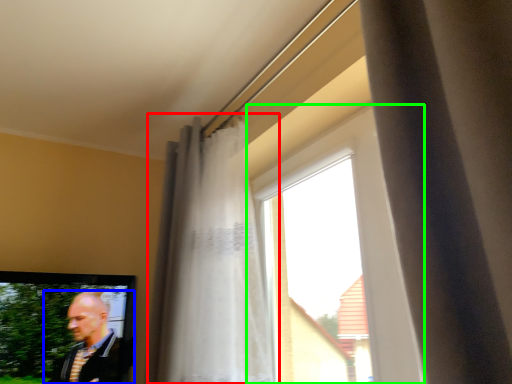
Question: Which object is positioned farthest from curtain (highlighted by a red box)? Select from man (highlighted by a blue box) and window (highlighted by a green box).

Choices:
 (A) man
 (B) window

Answer: (A)